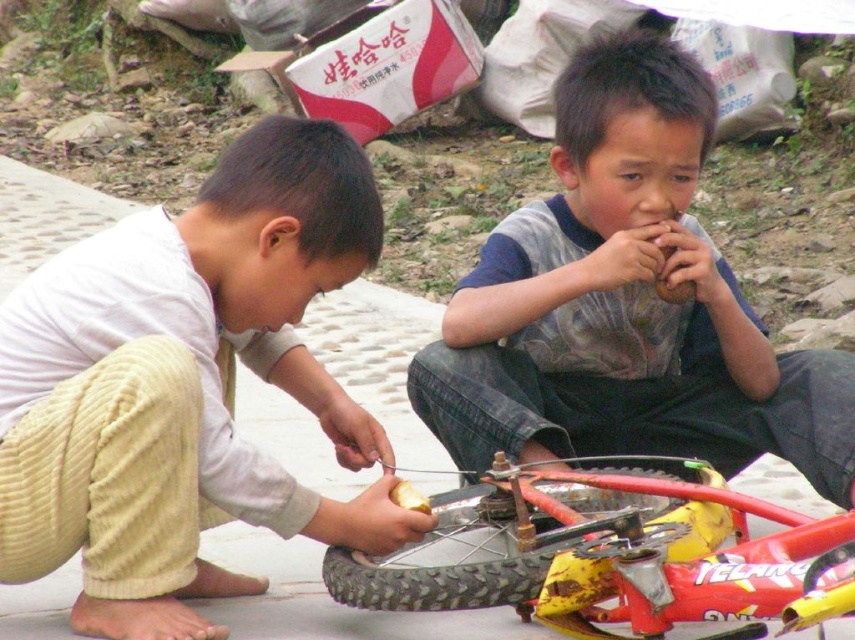
You are standing at the origin point in the image. There are two points marked in the image. Which point is closer to you, point (199, 202) or point (541, 336)?

Point (199, 202) is in front of point (541, 336), so it is closer to you.

You are a parent trying to choose the right size of a new shirt for your child. You see the white matte shirt at lower left and the gray cotton shirt at center in the image. Which shirt should you choose if you want the one that is smaller?

The white matte shirt at lower left is smaller than the gray cotton shirt at center, so you should choose the white matte shirt at lower left.

You are a photographer trying to capture a closeup of the white matte shirt at lower left and the yellow rubber tire at lower center. If your camera can only focus on objects wider than 10 inches, which object should you prioritize to ensure it is in focus?

The white matte shirt at lower left should be prioritized because its width is larger than the yellow rubber tire at lower center, making it more likely to be within the camera focus range of over 10 inches.